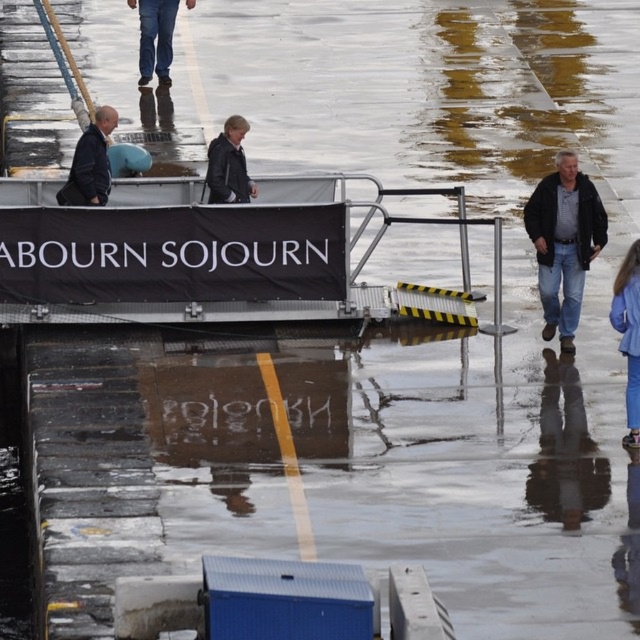
Does dark blue leather jacket at upper left come in front of dark gray leather jacket at center?

That is False.

Who is more distant from viewer, (93, 170) or (232, 195)?

The point (232, 195) is more distant.

I want to click on dark blue leather jacket at upper left, so click(90, 163).

Locate an element on the screen. This screenshot has width=640, height=640. dark blue leather jacket at upper left is located at coordinates [x=90, y=163].

Is point (240, 186) less distant than point (170, 48)?

Yes, it is in front of point (170, 48).

Between dark gray leather jacket at center and denim jeans at upper center, which one has less height?

With less height is dark gray leather jacket at center.

Which is in front, point (234, 141) or point (156, 45)?

Point (234, 141) is in front.

Image resolution: width=640 pixels, height=640 pixels. I want to click on dark gray leather jacket at center, so click(x=228, y=164).

Between blue denim jeans at lower right and dark blue leather jacket at upper left, which one appears on the left side from the viewer's perspective?

dark blue leather jacket at upper left is more to the left.

Locate an element on the screen. blue denim jeans at lower right is located at coordinates (628, 333).